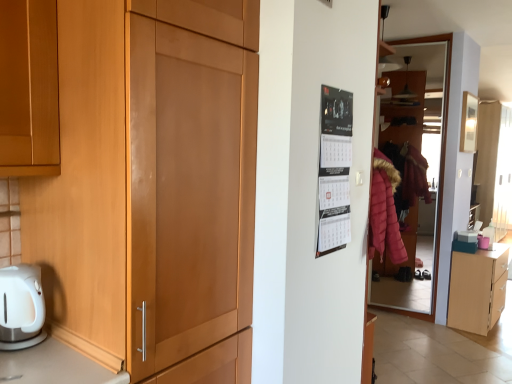
Question: Considering the positions of matte wood cupboard at left and light wood cabinet at lower right in the image, is matte wood cupboard at left wider or thinner than light wood cabinet at lower right?

Choices:
 (A) thin
 (B) wide

Answer: (B)

Question: Would you say matte wood cupboard at left is to the left or to the right of light wood cabinet at lower right in the picture?

Choices:
 (A) right
 (B) left

Answer: (B)

Question: Which object is the farthest from the matte glass door at right?

Choices:
 (A) light wood cabinet at lower right
 (B) matte wood cupboard at left
 (C) black paper calendar at upper right

Answer: (B)

Question: Estimate the real-world distances between objects in this image. Which object is closer to the matte wood cupboard at left?

Choices:
 (A) black paper calendar at upper right
 (B) matte glass door at right
 (C) light wood cabinet at lower right

Answer: (A)